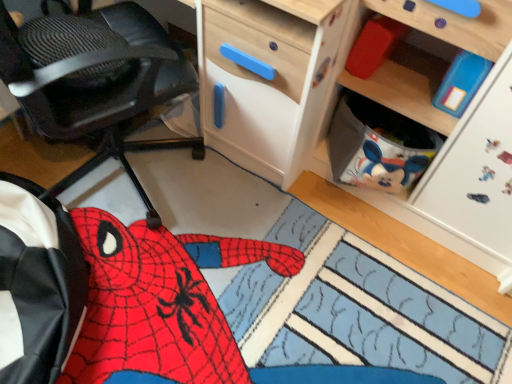
Question: Considering their positions, is wooden cabinet at upper right located in front of or behind black textured office chair at left?

Choices:
 (A) front
 (B) behind

Answer: (B)

Question: Does point (420, 74) appear closer or farther from the camera than point (39, 129)?

Choices:
 (A) farther
 (B) closer

Answer: (A)

Question: Considering the real-world distances, which object is closest to the matte red block at upper right?

Choices:
 (A) wooden cabinet at upper right
 (B) black textured office chair at left

Answer: (A)

Question: Which is nearer to the black textured office chair at left?

Choices:
 (A) matte red block at upper right
 (B) wooden cabinet at upper right

Answer: (B)